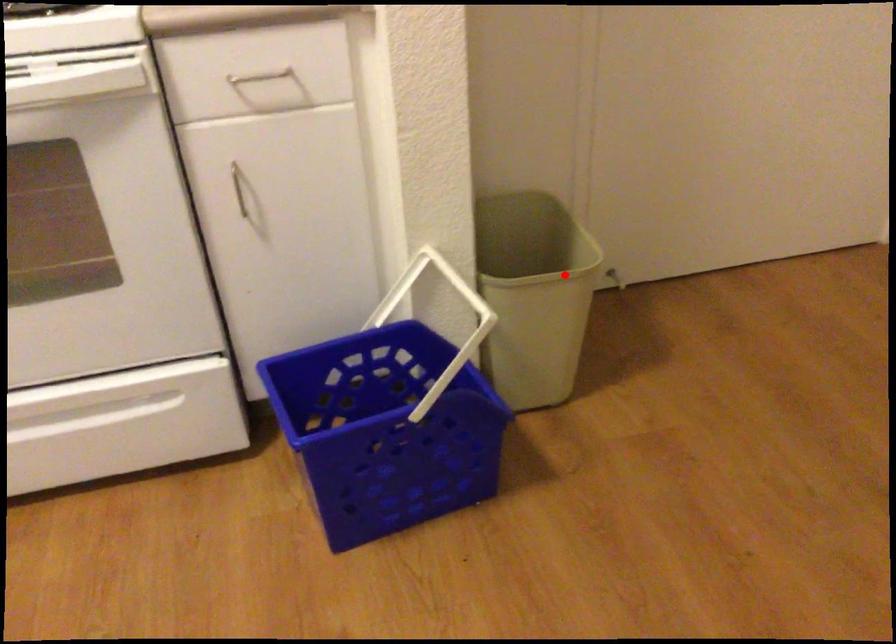
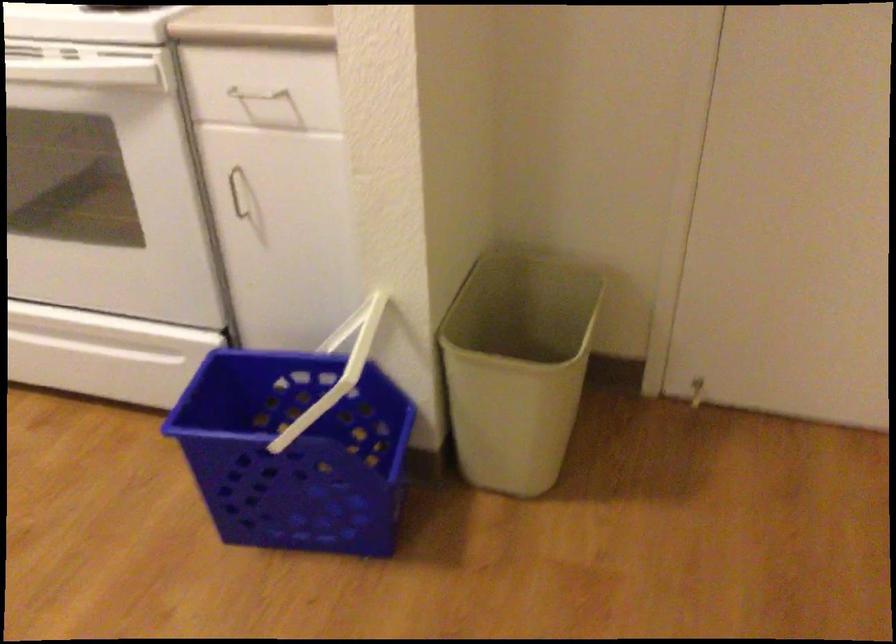
Find the pixel in the second image that matches the highlighted location in the first image.

(517, 366)